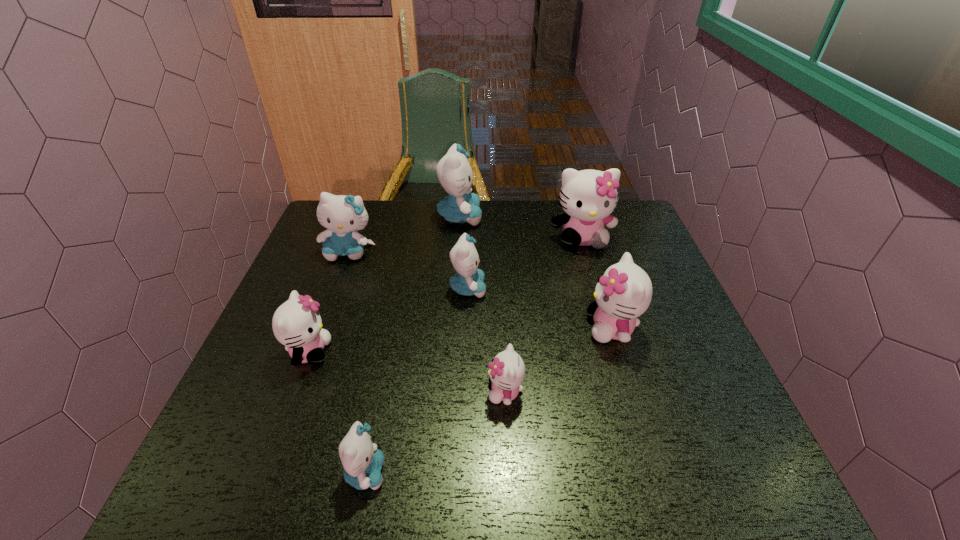
Locate an element on the screen. The image size is (960, 540). free space located 0.240m on the face of the farthest blue kitten is located at coordinates (555, 217).

The image size is (960, 540). Identify the location of vacant point located on the front-facing side of the farthest white kitten. (612, 341).

Identify the location of vacant point located 0.370m on the front-facing side of the second biggest white kitten. (434, 328).

Where is `free space located on the front-facing side of the second biggest white kitten`? Image resolution: width=960 pixels, height=540 pixels. free space located on the front-facing side of the second biggest white kitten is located at coordinates (479, 328).

The height and width of the screenshot is (540, 960). I want to click on vacant space located 0.290m on the front-facing side of the second biggest white kitten, so click(468, 328).

The image size is (960, 540). Identify the location of vacant point located 0.270m on the face of the leftmost blue kitten. (318, 336).

At what (x,y) coordinates should I click in order to perform the action: click on vacant space located on the face of the second nearest blue kitten. Please return your answer as a coordinate pair (x, y). The height and width of the screenshot is (540, 960). Looking at the image, I should click on (580, 288).

Identify the location of free location located 0.380m on the front-facing side of the second smallest white kitten. (495, 352).

Locate an element on the screen. vacant space located on the front-facing side of the smallest white kitten is located at coordinates (449, 392).

What are the coordinates of `free spot located 0.380m on the front-facing side of the smallest white kitten` in the screenshot? It's located at (308, 392).